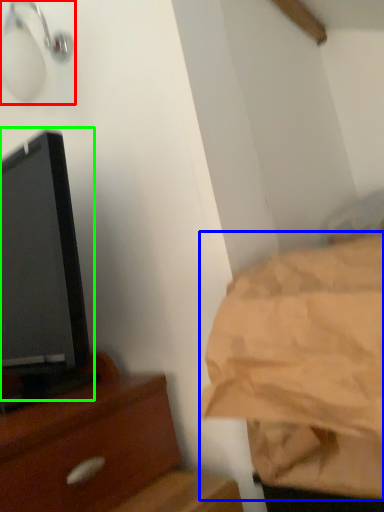
Question: Considering the real-world distances, which object is farthest from light fixture (highlighted by a red box)? sheet (highlighted by a blue box) or tv show (highlighted by a green box)?

Choices:
 (A) sheet
 (B) tv show

Answer: (A)